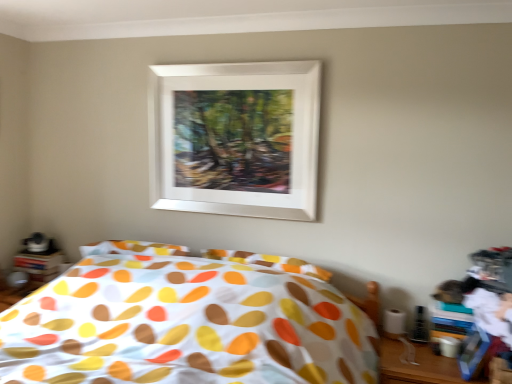
Question: Is point (204, 175) closer or farther from the camera than point (262, 375)?

Choices:
 (A) closer
 (B) farther

Answer: (B)

Question: Considering their positions, is white matte picture frame at upper center located in front of or behind polka dot fabric bed at center?

Choices:
 (A) behind
 (B) front

Answer: (A)

Question: Which of these objects is positioned farthest from the wooden table at lower right?

Choices:
 (A) polka dot fabric bed at center
 (B) white matte picture frame at upper center

Answer: (B)

Question: Based on their relative distances, which object is farther from the polka dot fabric bed at center?

Choices:
 (A) white matte picture frame at upper center
 (B) wooden table at lower right

Answer: (B)